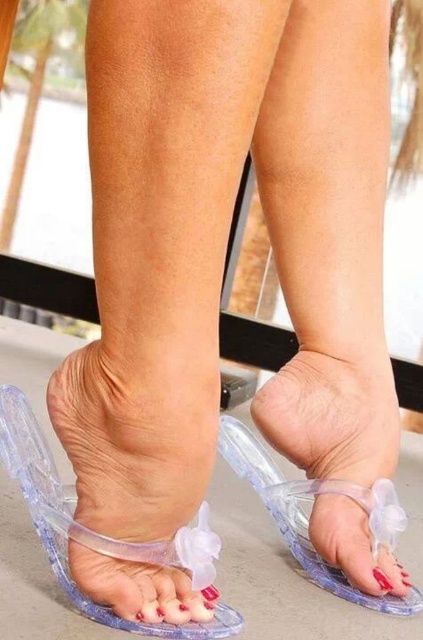
Question: Which point is closer to the camera taking this photo?

Choices:
 (A) (313, 403)
 (B) (382, 573)

Answer: (B)

Question: Is transparent plastic flip-flop at lower center behind transparent plastic flip-flop at center?

Choices:
 (A) no
 (B) yes

Answer: (A)

Question: Does transparent plastic flip-flop at center appear on the right side of clear plastic toe at center?

Choices:
 (A) yes
 (B) no

Answer: (B)

Question: Is transparent plastic flip-flop at lower center positioned before transparent plastic flip-flop at center?

Choices:
 (A) no
 (B) yes

Answer: (B)

Question: Estimate the real-world distances between objects in this image. Which object is farther from the transparent plastic flip-flop at lower center?

Choices:
 (A) clear plastic toe at center
 (B) transparent plastic flip-flop at center

Answer: (A)

Question: Which of the following is the closest to the observer?

Choices:
 (A) transparent plastic flip-flop at center
 (B) clear plastic toe at center
 (C) transparent plastic flip-flop at lower center

Answer: (C)